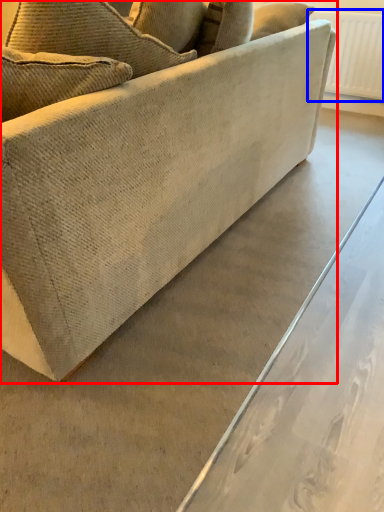
Question: Which of the following is the farthest to the observer, studio couch (highlighted by a red box) or radiator (highlighted by a blue box)?

Choices:
 (A) studio couch
 (B) radiator

Answer: (B)